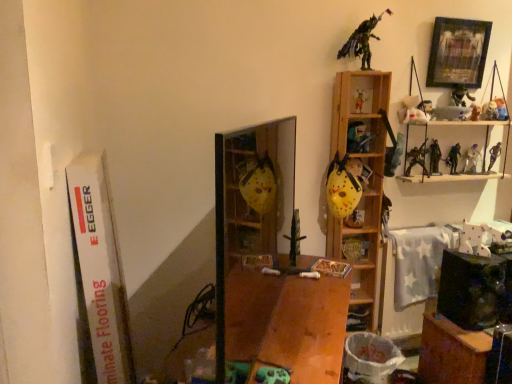
Question: In terms of width, does white matte plush toy at upper right, the eighth toy viewed from the left, look wider or thinner when compared to metallic silver figure at upper right, positioned as the seventh toy in right-to-left order?

Choices:
 (A) thin
 (B) wide

Answer: (A)

Question: From a real-world perspective, relative to metallic silver figure at upper right, marked as the ninth toy in a left-to-right arrangement, is white matte plush toy at upper right, the eighth toy viewed from the left, vertically above or below?

Choices:
 (A) below
 (B) above

Answer: (B)

Question: Which of these objects is positioned closest to the metallic sword at center, acting as the first toy starting from the left?

Choices:
 (A) wooden shelf at upper right
 (B) matte yellow mask at upper center, placed as the 11th toy when sorted from right to left
 (C) white matte plush toy at upper right, the eighth toy viewed from the left
 (D) transparent plastic cabinet at center, the 1th cabinet in the left-to-right sequence
 (E) yellow matte mask at center, placed as the 14th toy when sorted from right to left

Answer: (E)

Question: Estimate the real-world distances between objects in this image. Which object is closer to the wooden table at center?

Choices:
 (A) wooden shelf at upper right
 (B) metallic silver figure at upper right, the 2th toy from the right
 (C) metallic silver toy at upper right, which is the fifth toy in right-to-left order
 (D) matte plastic toy soldier at upper right, which is the third toy in right-to-left order
 (E) white plush toy at upper right, the 6th toy viewed from the left

Answer: (A)